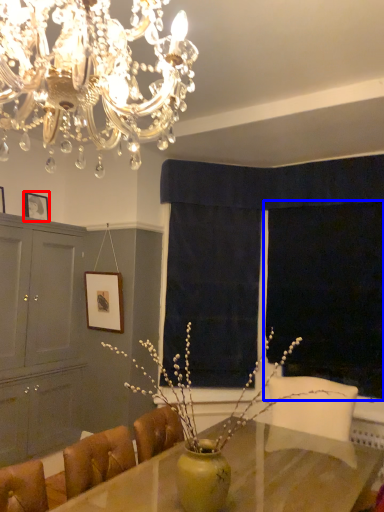
Question: Which of the following is the closest to the observer, picture frame (highlighted by a red box) or window screen (highlighted by a blue box)?

Choices:
 (A) picture frame
 (B) window screen

Answer: (B)